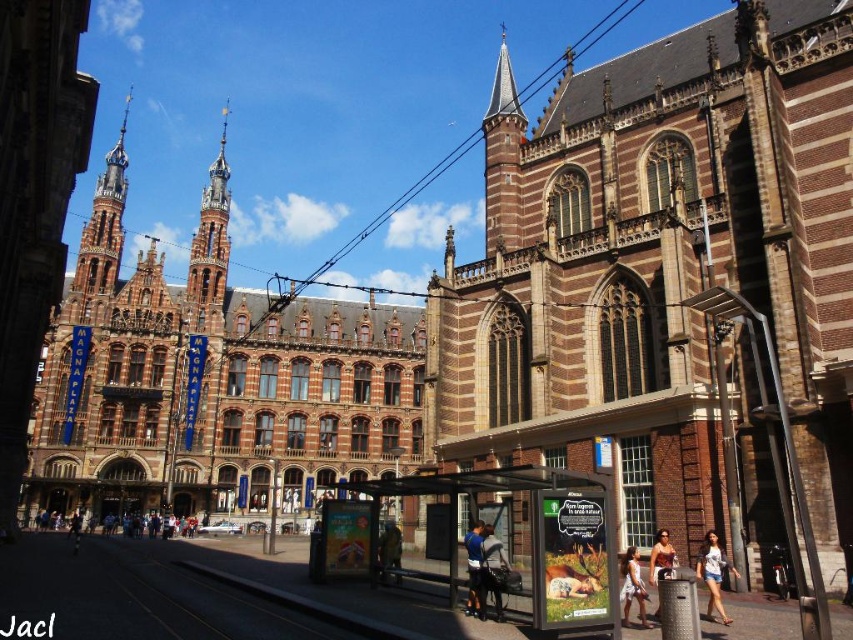
Question: Is brown stone church at center thinner than white cotton dress at lower right?

Choices:
 (A) no
 (B) yes

Answer: (A)

Question: Is dark blue shirt at center behind light brown wooden bench at lower center?

Choices:
 (A) no
 (B) yes

Answer: (A)

Question: Which object is the farthest from the brown brick church at center?

Choices:
 (A) blue denim jeans at center
 (B) brown leather jacket at center
 (C) white cotton dress at lower right
 (D) white cotton shirt at lower right

Answer: (D)

Question: Estimate the real-world distances between objects in this image. Which object is closer to the white cotton shirt at lower right?

Choices:
 (A) tan skin person at center
 (B) brown leather jacket at center
 (C) polished copper spire at upper left

Answer: (A)

Question: Among these objects, which one is nearest to the camera?

Choices:
 (A) polished copper spire at upper left
 (B) tan skin person at center
 (C) dark blue shirt at center

Answer: (C)

Question: Is transparent plastic bus stop at center further to camera compared to dark blue shirt at center?

Choices:
 (A) no
 (B) yes

Answer: (A)